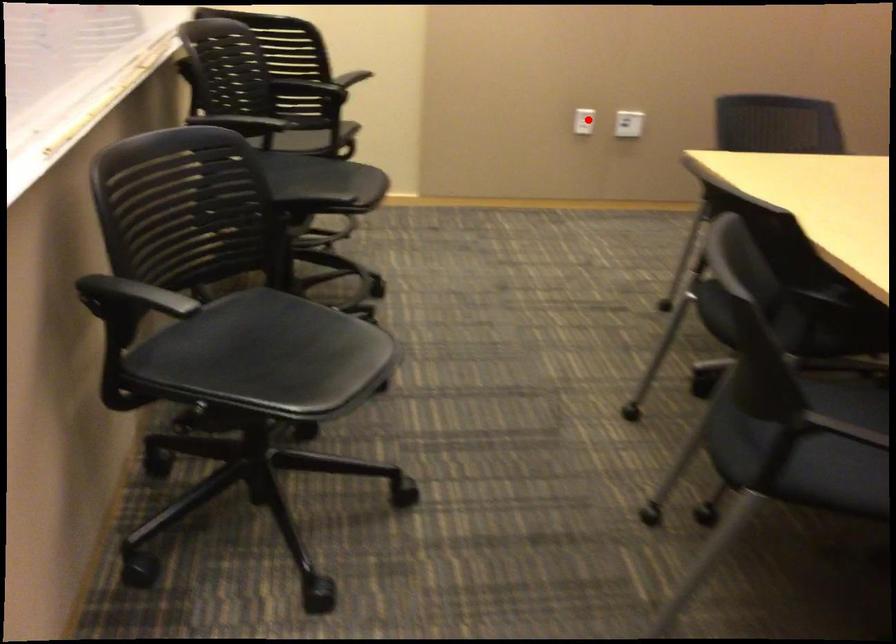
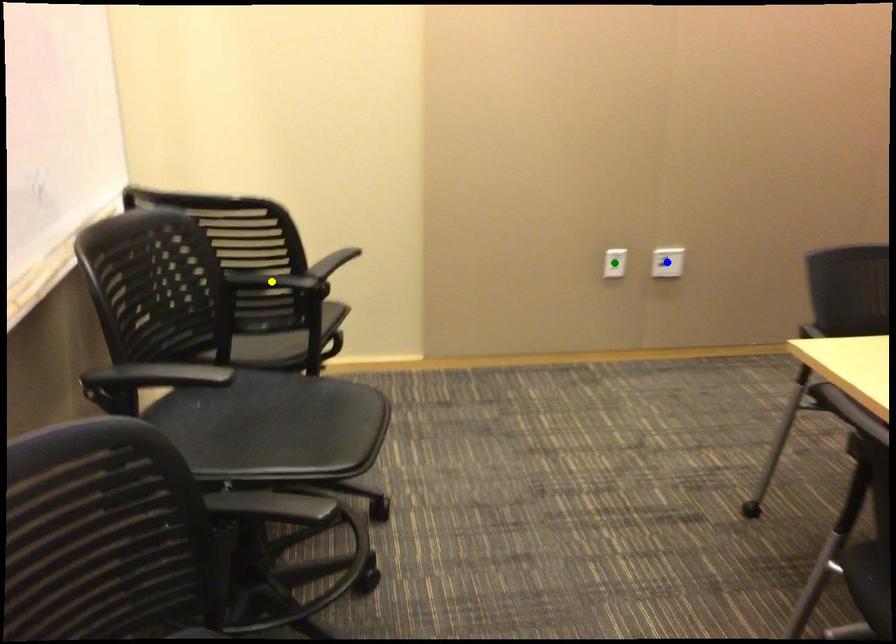
Question: I am providing you with two images of the same scene from different viewpoints. A red point is marked on the first image. You are given multiple points on the second image. Which mark in image 2 goes with the point in image 1?

Choices:
 (A) green point
 (B) blue point
 (C) yellow point

Answer: (A)